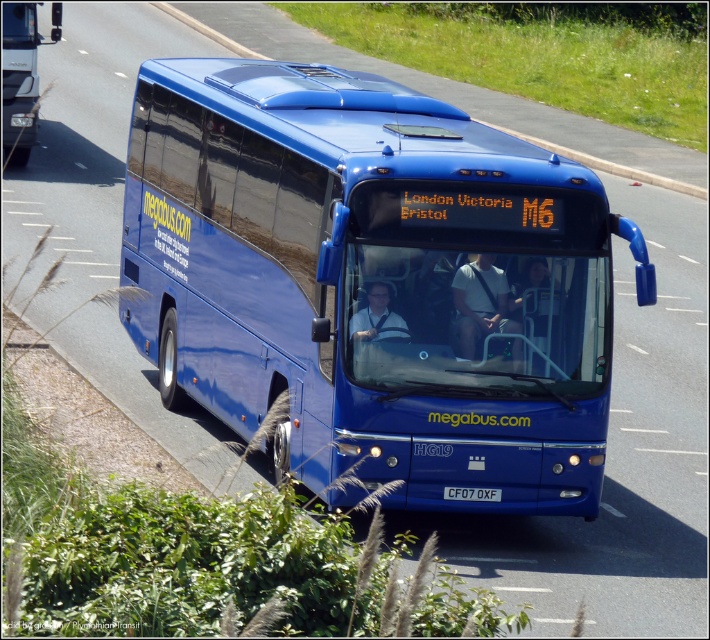
Question: Can you confirm if white fabric shirt at center is positioned to the left of white plastic license plate at center?

Choices:
 (A) no
 (B) yes

Answer: (A)

Question: Which point is farther from the camera taking this photo?

Choices:
 (A) (366, 291)
 (B) (459, 496)
 (C) (21, 90)

Answer: (C)

Question: Does blue metallic bus at center have a greater width compared to matte blue bus at upper center?

Choices:
 (A) no
 (B) yes

Answer: (B)

Question: Considering the relative positions of blue metallic bus at center and white plastic license plate at center in the image provided, where is blue metallic bus at center located with respect to white plastic license plate at center?

Choices:
 (A) left
 (B) right

Answer: (A)

Question: Which of these objects is positioned closest to the matte blue bus at upper center?

Choices:
 (A) white plastic license plate at center
 (B) matte blue shirt at center
 (C) white fabric shirt at center
 (D) blue metallic bus at center

Answer: (B)

Question: Which of the following is the closest to the observer?

Choices:
 (A) (371, 321)
 (B) (457, 506)
 (C) (491, 500)
 (D) (6, 129)

Answer: (A)